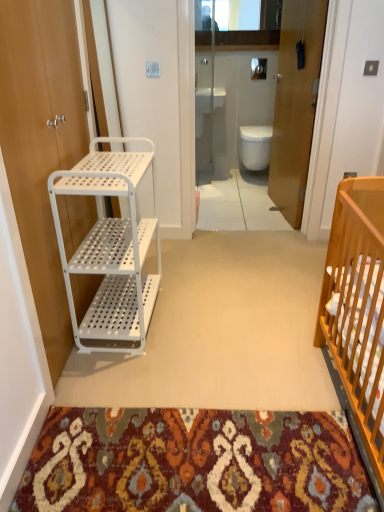
Where is `empty space that is to the right of white matte door at left, acting as the 1th door starting from the front`? The image size is (384, 512). empty space that is to the right of white matte door at left, acting as the 1th door starting from the front is located at coordinates (224, 323).